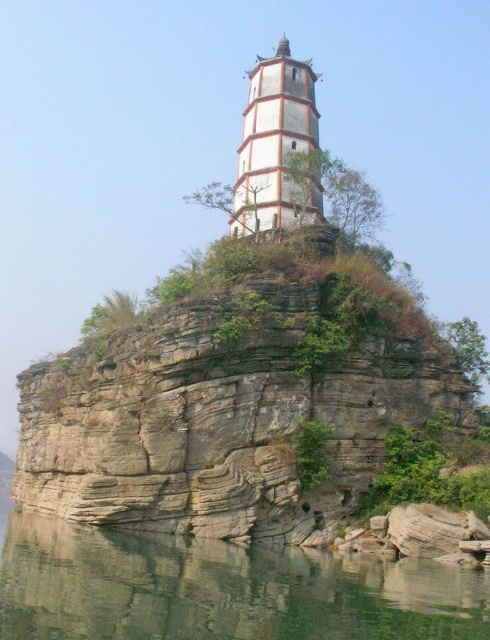
Is clear water at lower center positioned at the back of white striped tower at center?

Result: That is False.

Find the location of a particular element. clear water at lower center is located at coordinates (220, 589).

The height and width of the screenshot is (640, 490). What are the coordinates of `clear water at lower center` in the screenshot? It's located at (220, 589).